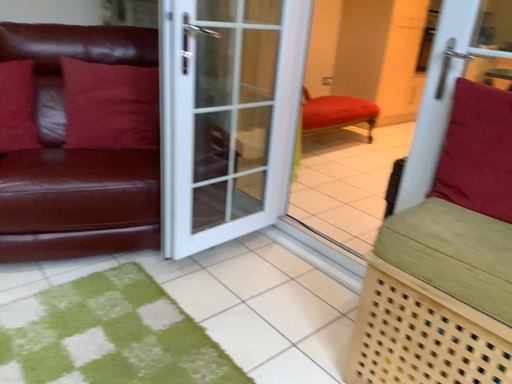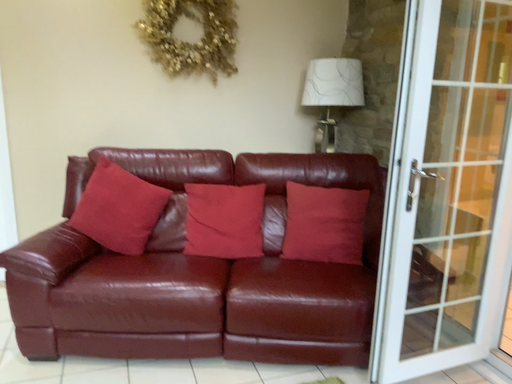
Question: Which way did the camera rotate in the video?

Choices:
 (A) rotated left
 (B) rotated right

Answer: (A)